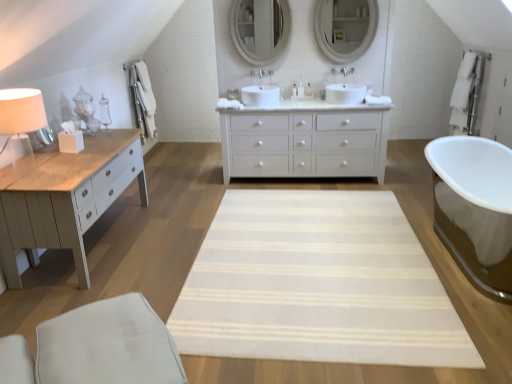
Locate an element on the screen. vacant area situated below matte white lampshade at left (from a real-world perspective) is located at coordinates (60, 273).